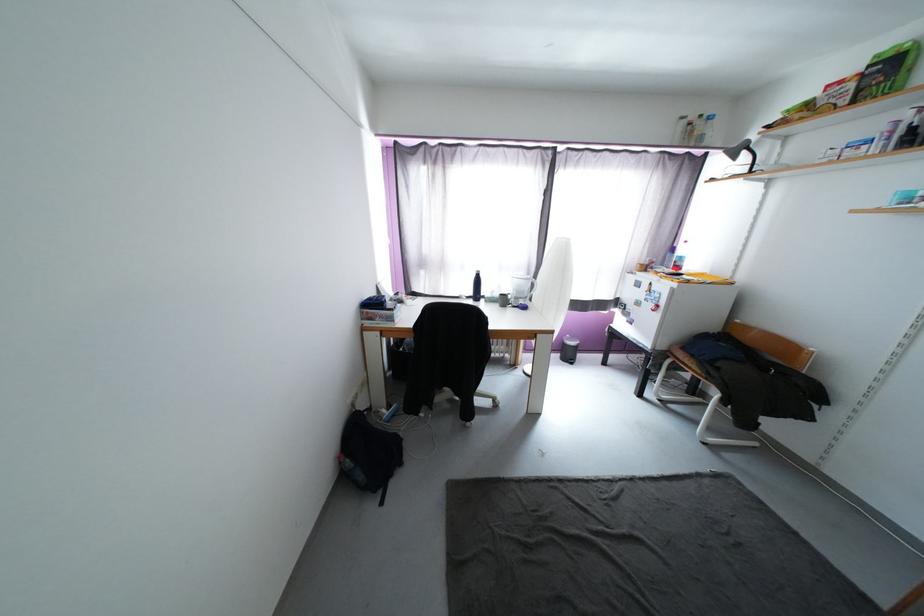
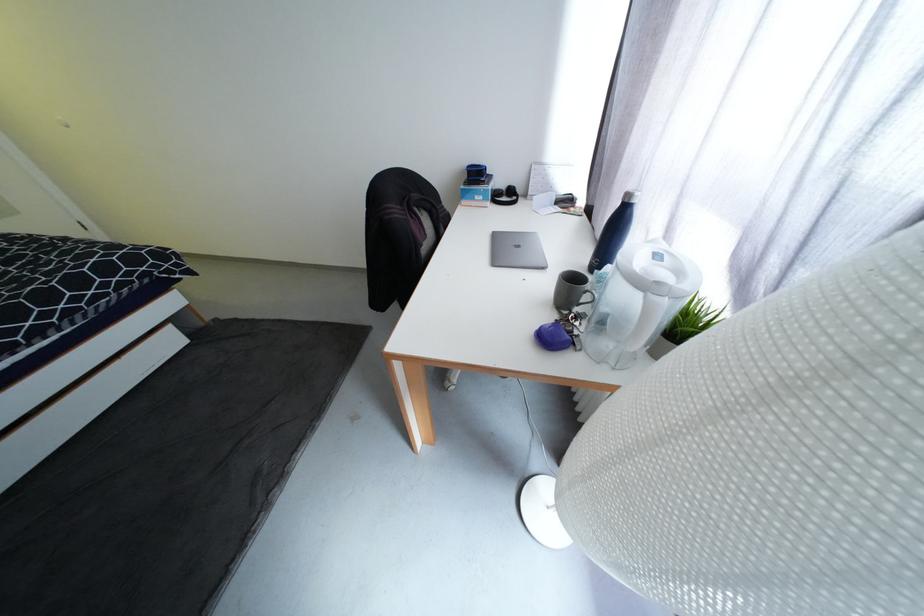
The point at (480, 277) is marked in the first image. Where is the corresponding point in the second image?

(626, 205)